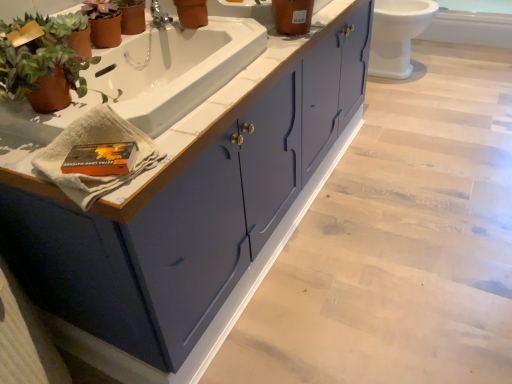
Locate an element on the screen. vacant space in front of white glossy toilet at upper right is located at coordinates (433, 99).